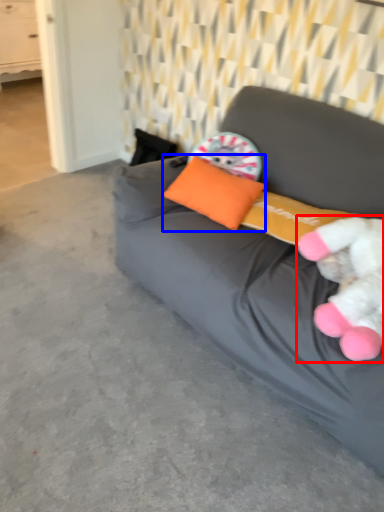
Question: Among these objects, which one is nearest to the camera, toy (highlighted by a red box) or pillow (highlighted by a blue box)?

Choices:
 (A) toy
 (B) pillow

Answer: (A)